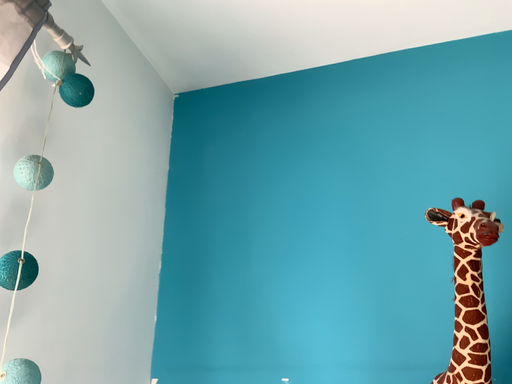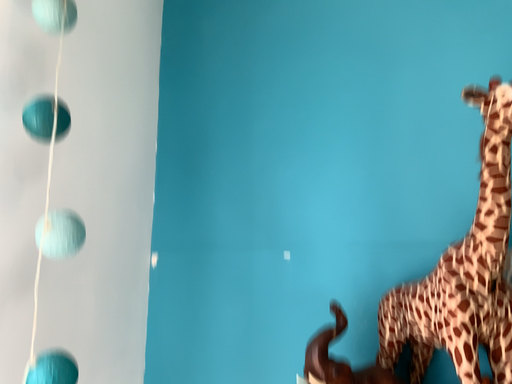
Question: How did the camera likely rotate when shooting the video?

Choices:
 (A) rotated right
 (B) rotated left

Answer: (A)